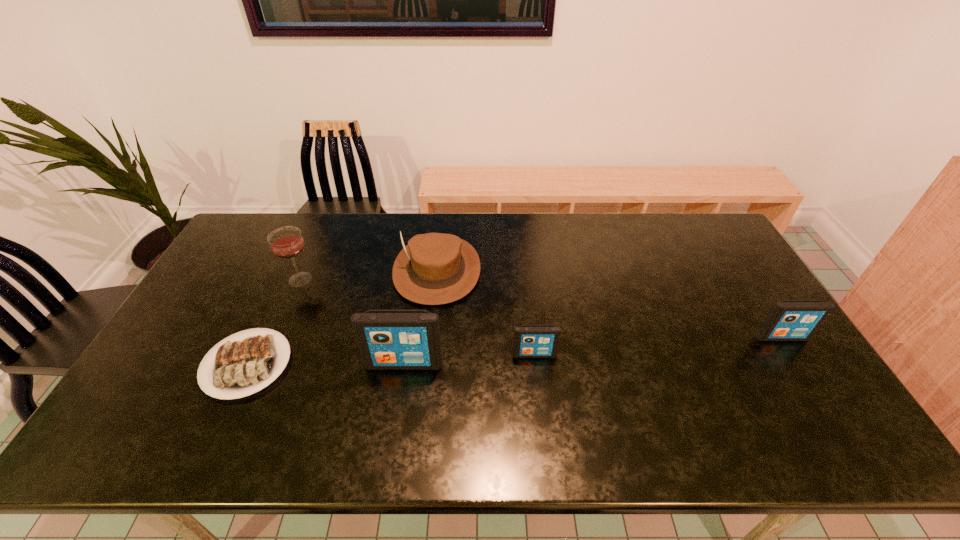
The image size is (960, 540). Find the location of `the leftmost iPod`. the leftmost iPod is located at coordinates (387, 339).

I want to click on the second shortest object, so click(530, 341).

I want to click on the shortest iPod, so click(530, 341).

Locate an element on the screen. the third shortest object is located at coordinates (789, 320).

The image size is (960, 540). In order to click on the rightmost iPod in this screenshot , I will do `click(789, 320)`.

At what (x,y) coordinates should I click in order to perform the action: click on wineglass. Please return your answer as a coordinate pair (x, y). The width and height of the screenshot is (960, 540). Looking at the image, I should click on (286, 242).

At what (x,y) coordinates should I click in order to perform the action: click on fedora. Please return your answer as a coordinate pair (x, y). The width and height of the screenshot is (960, 540). Looking at the image, I should click on (435, 268).

In order to click on plate in this screenshot , I will do `click(241, 368)`.

This screenshot has height=540, width=960. In order to click on vacant space located on the front screen of the tallest iPod in this screenshot , I will do `click(397, 408)`.

You are a GUI agent. You are given a task and a screenshot of the screen. Output one action in this format:
    pyautogui.click(x=<x>, y=<y>)
    Task: Click on the free region located 0.150m on the front screen of the shortest iPod
    
    Given the screenshot: What is the action you would take?
    pyautogui.click(x=540, y=408)